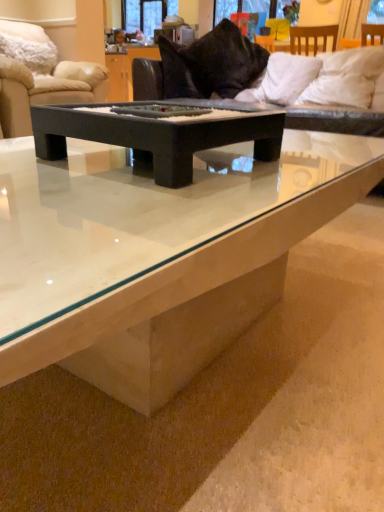
Question: Is black matte tray at center, the 1th coffee table positioned from the top, wider or thinner than black velvet pillow at upper center, marked as the third pillow in a right-to-left arrangement?

Choices:
 (A) wide
 (B) thin

Answer: (A)

Question: In the image, is black matte tray at center, the 1th coffee table positioned from the top, positioned in front of or behind black velvet pillow at upper center, marked as the third pillow in a right-to-left arrangement?

Choices:
 (A) front
 (B) behind

Answer: (A)

Question: Which object is positioned farthest from the transparent glass window screen at upper center, arranged as the second window screen when viewed from the right?

Choices:
 (A) white marble coffee table at center, which is counted as the 2th coffee table, starting from the top
 (B) black velvet pillow at upper center, marked as the third pillow in a right-to-left arrangement
 (C) beige fabric couch at upper left, which is the 2th studio couch from right to left
 (D) black matte tray at center, the 1th coffee table positioned from the top
 (E) velvet black couch at upper center, which appears as the second studio couch when viewed from the left

Answer: (A)

Question: Which of these objects is positioned farthest from the matte glass window screen at upper center, acting as the first window screen starting from the front?

Choices:
 (A) white marble coffee table at center, which is counted as the 2th coffee table, starting from the top
 (B) black velvet pillow at upper center, the second pillow in the left-to-right sequence
 (C) velvet black couch at upper center, which appears as the second studio couch when viewed from the left
 (D) beige fabric couch at upper left, which is counted as the 1th studio couch, starting from the left
 (E) white soft pillow at upper right, which ranks as the fourth pillow in left-to-right order

Answer: (A)